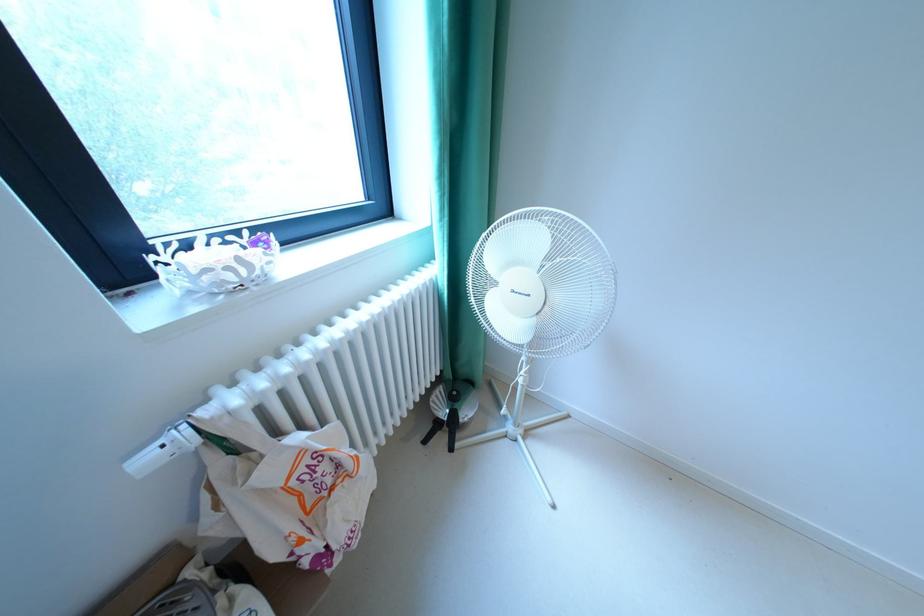
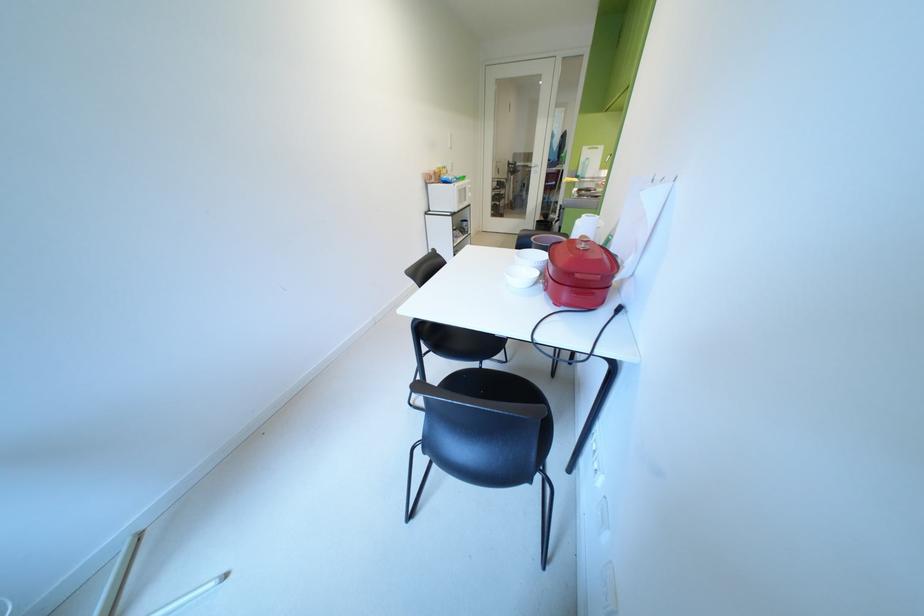
First-person continuous shooting, in which direction is the camera rotating?

The camera's rotation is toward right-down.